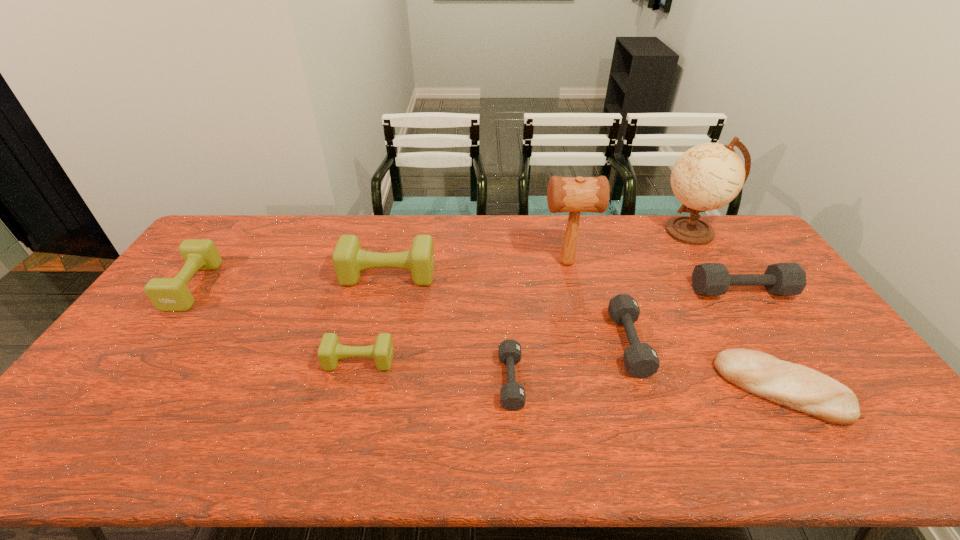
Identify which gray dumbbell is the closest to the bread. Please provide its 2D coordinates. Your answer should be formatted as a tuple, i.e. [(x, y)], where the tuple contains the x and y coordinates of a point satisfying the conditions above.

[(641, 360)]

The height and width of the screenshot is (540, 960). In order to click on free space that satisfies the following two spatial constraints: 1. on the back side of the second dumbbell from right to left; 2. on the right side of the shortest object in this screenshot , I will do `click(508, 343)`.

Find the location of `free location that satisfies the following two spatial constraints: 1. on the strike surface of the mallet; 2. on the front side of the leftmost gray dumbbell`. free location that satisfies the following two spatial constraints: 1. on the strike surface of the mallet; 2. on the front side of the leftmost gray dumbbell is located at coordinates (594, 381).

Image resolution: width=960 pixels, height=540 pixels. I want to click on free space in the image that satisfies the following two spatial constraints: 1. on the surface of the rightmost dumbbell; 2. on the left side of the beige globe, so click(x=728, y=292).

Find the location of `vacant point that satisfies the following two spatial constraints: 1. on the back side of the bread; 2. on the strike surface of the mallet`. vacant point that satisfies the following two spatial constraints: 1. on the back side of the bread; 2. on the strike surface of the mallet is located at coordinates (705, 263).